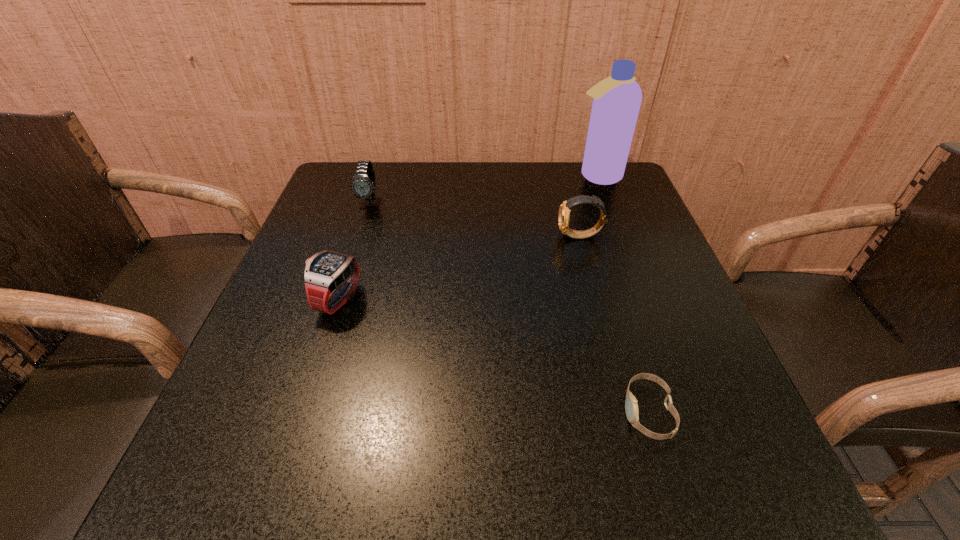
The width and height of the screenshot is (960, 540). I want to click on object at the far right corner, so click(x=617, y=99).

Where is `vacant space at the far edge of the desktop`? This screenshot has height=540, width=960. vacant space at the far edge of the desktop is located at coordinates (464, 167).

Locate an element on the screen. The width and height of the screenshot is (960, 540). vacant space at the near edge is located at coordinates (408, 465).

Identify the location of free spot at the left edge of the desktop. This screenshot has height=540, width=960. 342,338.

Locate an element on the screen. vacant region at the right edge of the desktop is located at coordinates (619, 244).

The image size is (960, 540). Identify the location of vacant region at the far left corner of the desktop. (340, 193).

Where is `free space at the near left corner of the desktop`? Image resolution: width=960 pixels, height=540 pixels. free space at the near left corner of the desktop is located at coordinates (262, 451).

In the image, there is a desktop. Where is `vacant space at the near right corner`? Image resolution: width=960 pixels, height=540 pixels. vacant space at the near right corner is located at coordinates (694, 459).

Where is `unoccupied area between the shampoo and the third farthest object`? unoccupied area between the shampoo and the third farthest object is located at coordinates (588, 206).

At what (x,y) coordinates should I click in order to perform the action: click on free space between the farthest watch and the nearest object. Please return your answer as a coordinate pair (x, y). This screenshot has width=960, height=540. Looking at the image, I should click on (510, 308).